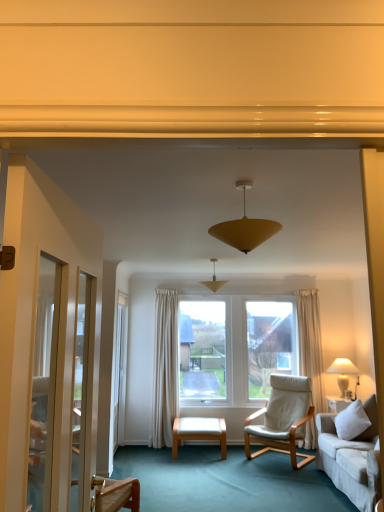
Question: Can you confirm if white leather ottoman at center is wider than white fabric lampshade at right, the 1th lamp from the right?

Choices:
 (A) no
 (B) yes

Answer: (B)

Question: Does white leather ottoman at center lie behind white fabric lampshade at right, marked as the 3th lamp in a top-to-bottom arrangement?

Choices:
 (A) yes
 (B) no

Answer: (B)

Question: Is white leather ottoman at center aimed at white fabric lampshade at right, the 3th lamp positioned from the left?

Choices:
 (A) yes
 (B) no

Answer: (B)

Question: Is white leather ottoman at center surrounding white fabric lampshade at right, the 1th lamp from the right?

Choices:
 (A) no
 (B) yes

Answer: (A)

Question: Considering the relative sizes of white leather ottoman at center and white fabric lampshade at right, marked as the 3th lamp in a top-to-bottom arrangement, in the image provided, is white leather ottoman at center shorter than white fabric lampshade at right, marked as the 3th lamp in a top-to-bottom arrangement,?

Choices:
 (A) no
 (B) yes

Answer: (B)

Question: Looking at their shapes, would you say white leather chair at center is wider or thinner than matte yellow cone at center, which is the 3th lamp in bottom-to-top order?

Choices:
 (A) thin
 (B) wide

Answer: (B)

Question: From a real-world perspective, is white leather chair at center physically located above or below matte yellow cone at center, which is the 1th lamp in front-to-back order?

Choices:
 (A) above
 (B) below

Answer: (B)

Question: Relative to matte yellow cone at center, acting as the 1th lamp starting from the top, is white leather chair at center in front or behind?

Choices:
 (A) front
 (B) behind

Answer: (B)

Question: Would you say white leather chair at center is inside or outside matte yellow cone at center, which is the 3th lamp in bottom-to-top order?

Choices:
 (A) inside
 (B) outside

Answer: (B)

Question: In terms of size, does matte yellow cone at center, acting as the 1th lamp starting from the top, appear bigger or smaller than white glossy screen door at left?

Choices:
 (A) big
 (B) small

Answer: (B)

Question: Choose the correct answer: Is matte yellow cone at center, acting as the 1th lamp starting from the top, inside white glossy screen door at left or outside it?

Choices:
 (A) outside
 (B) inside

Answer: (A)

Question: Is matte yellow cone at center, which appears as the 1th lamp when viewed from the left, taller or shorter than white glossy screen door at left?

Choices:
 (A) short
 (B) tall

Answer: (A)

Question: From the image's perspective, is matte yellow cone at center, which appears as the third lamp when viewed from the right, above or below white glossy screen door at left?

Choices:
 (A) below
 (B) above

Answer: (B)

Question: Considering the positions of white leather ottoman at center and white leather chair at center in the image, is white leather ottoman at center bigger or smaller than white leather chair at center?

Choices:
 (A) big
 (B) small

Answer: (B)

Question: Is white leather ottoman at center spatially inside white leather chair at center, or outside of it?

Choices:
 (A) inside
 (B) outside

Answer: (B)